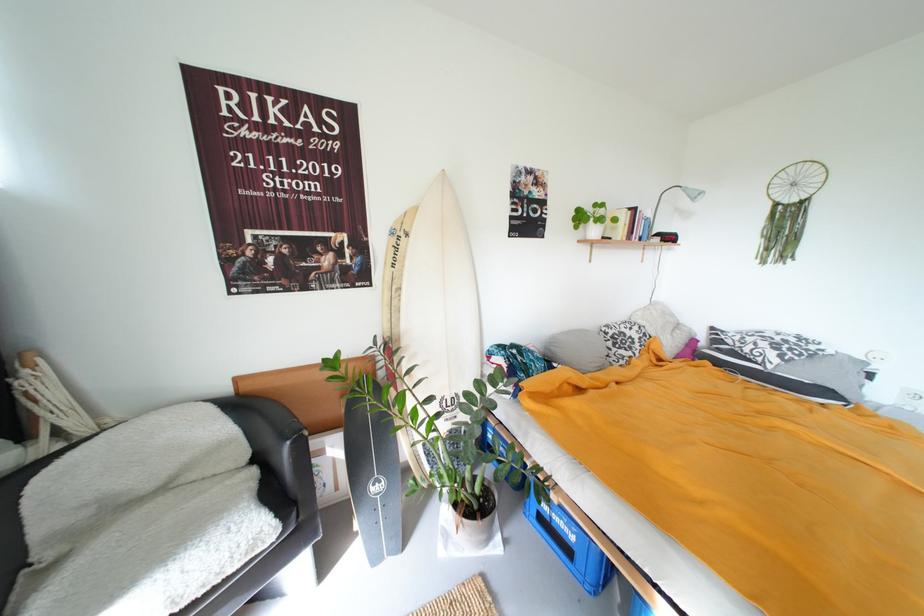
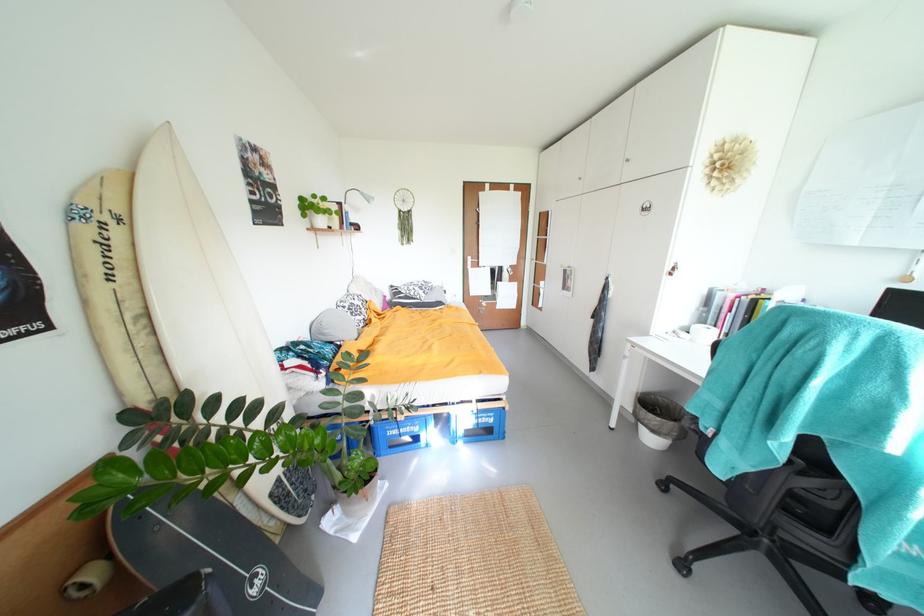
Question: I am providing you with two images of the same scene from different viewpoints. Please identify which objects are invisible in image2.

Choices:
 (A) grey pillow
 (B) terracotta flower pot
 (C) door handle
 (D) none of these

Answer: (D)